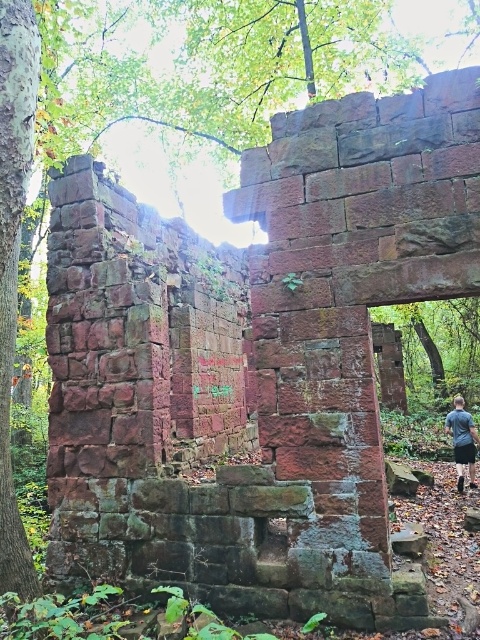
Between point (22, 80) and point (464, 433), which one is positioned in front?

Point (22, 80) is more forward.

You are a GUI agent. You are given a task and a screenshot of the screen. Output one action in this format:
    pyautogui.click(x=<x>, y=<y>)
    Task: Click on the smooth bark tree at left
    
    Given the screenshot: What is the action you would take?
    pyautogui.click(x=13, y=257)